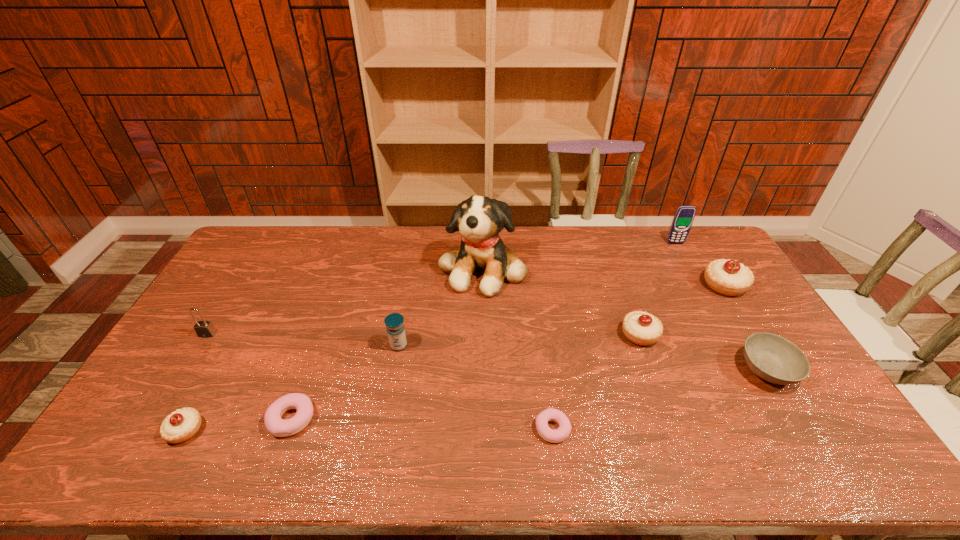
Where is `pastry positioned at the left edge`? pastry positioned at the left edge is located at coordinates (181, 425).

The height and width of the screenshot is (540, 960). Identify the location of cellular telephone that is positioned at the right edge. pyautogui.click(x=684, y=216).

You are a GUI agent. You are given a task and a screenshot of the screen. Output one action in this format:
    pyautogui.click(x=<x>, y=<y>)
    Task: Click on the pastry that is positioned at the right edge
    
    Given the screenshot: What is the action you would take?
    pyautogui.click(x=727, y=277)

Identify the location of bowl at the right edge. (773, 358).

This screenshot has width=960, height=540. Identify the location of object that is at the near left corner. (181, 425).

Where is `object that is at the far right corner`? The height and width of the screenshot is (540, 960). object that is at the far right corner is located at coordinates (684, 216).

Where is `free spot at the far edge of the desktop`? free spot at the far edge of the desktop is located at coordinates (627, 244).

This screenshot has width=960, height=540. In the image, there is a desktop. Identify the location of vacant space at the left edge. (204, 315).

Locate an element on the screen. Image resolution: width=960 pixels, height=540 pixels. vacant space at the right edge of the desktop is located at coordinates (729, 325).

You are a GUI agent. You are given a task and a screenshot of the screen. Output one action in this format:
    pyautogui.click(x=<x>, y=<y>)
    Task: Click on the vacant point located between the shortest object and the tallest object
    The height and width of the screenshot is (540, 960).
    Given the screenshot: What is the action you would take?
    pyautogui.click(x=517, y=348)